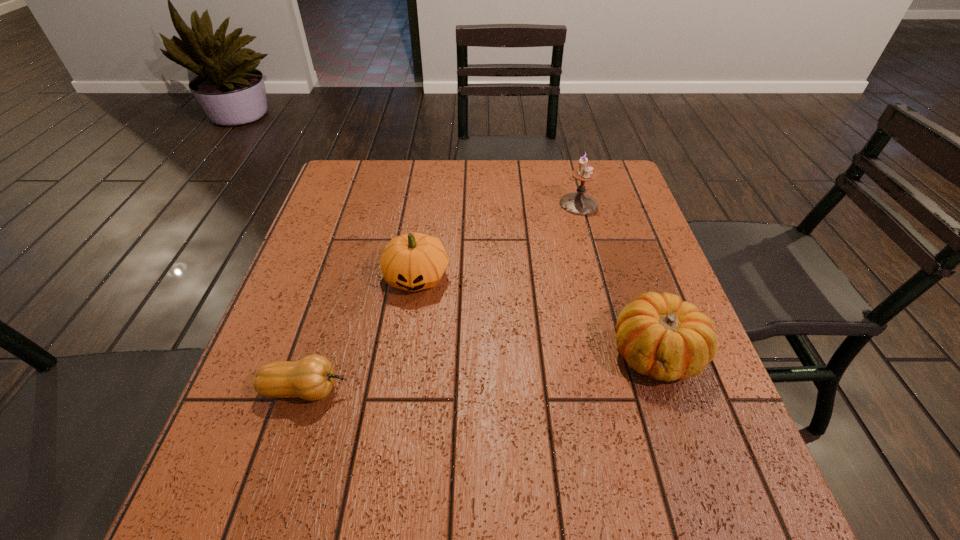
Locate an element on the screen. Image resolution: width=960 pixels, height=540 pixels. free space that satisfies the following two spatial constraints: 1. on the front side of the rightmost gourd; 2. on the right side of the farthest object is located at coordinates (619, 353).